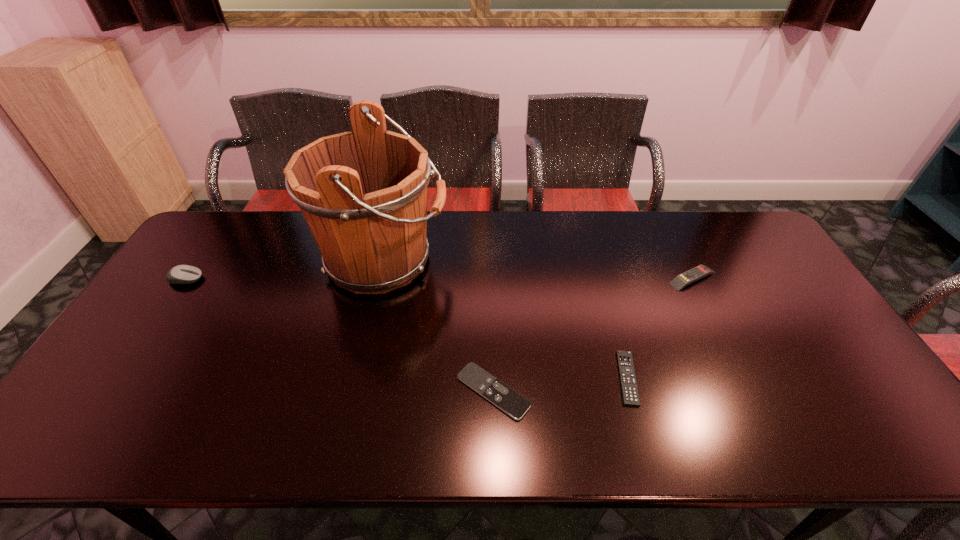
I want to click on the tallest object, so click(x=363, y=193).

At what (x,y) coordinates should I click in order to perform the action: click on the second object from left to right. Please return your answer as a coordinate pair (x, y). This screenshot has width=960, height=540. Looking at the image, I should click on (363, 193).

The image size is (960, 540). I want to click on the fourth shortest object, so click(x=182, y=274).

I want to click on computer equipment, so click(182, 274).

Locate an element on the screen. the rightmost remote control is located at coordinates (679, 282).

Locate an element on the screen. This screenshot has width=960, height=540. the farthest remote control is located at coordinates (679, 282).

Find the location of `the leftmost remote control`. the leftmost remote control is located at coordinates (505, 398).

Image resolution: width=960 pixels, height=540 pixels. Find the location of `the second remote control from left to right`. the second remote control from left to right is located at coordinates (630, 395).

Locate an element on the screen. This screenshot has height=540, width=960. vacant space situated with the handle on the side of the tallest object is located at coordinates (465, 260).

Identify the location of vacant space situated on the wheel side of the computer equipment. The width and height of the screenshot is (960, 540). (248, 279).